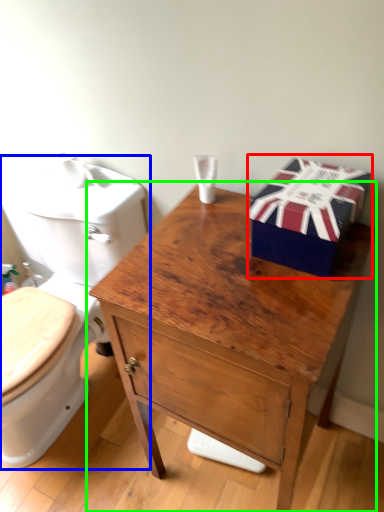
Question: Estimate the real-world distances between objects in this image. Which object is farther from gift box (highlighted by a red box), toilet (highlighted by a blue box) or table (highlighted by a green box)?

Choices:
 (A) toilet
 (B) table

Answer: (A)